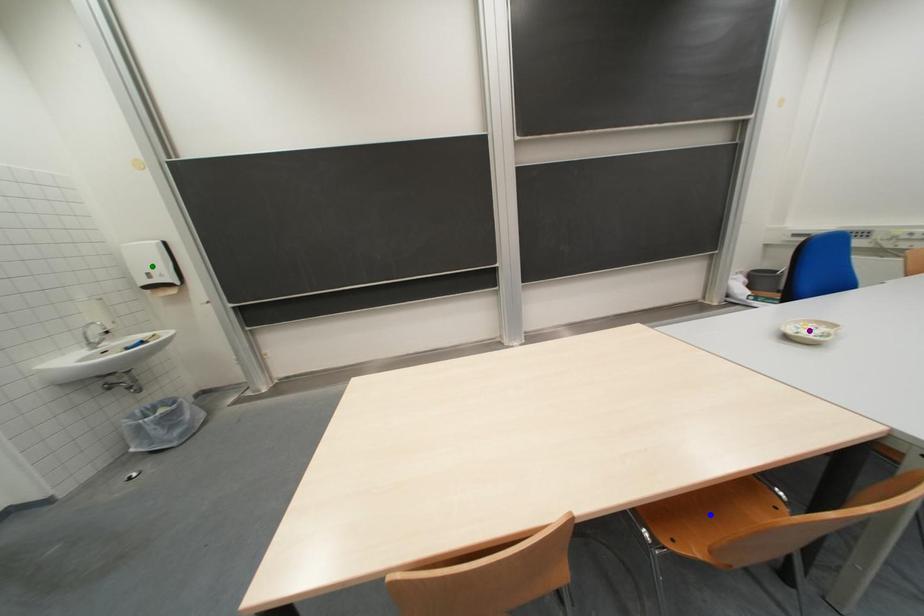
Order these from farthest to nearest:
1. purple point
2. green point
3. blue point

green point → purple point → blue point